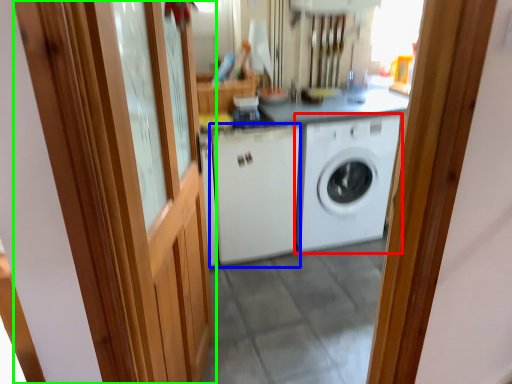
Question: Considering the real-world distances, which object is farthest from washing machine (highlighted by a red box)? washing machine (highlighted by a blue box) or barn door (highlighted by a green box)?

Choices:
 (A) washing machine
 (B) barn door

Answer: (B)